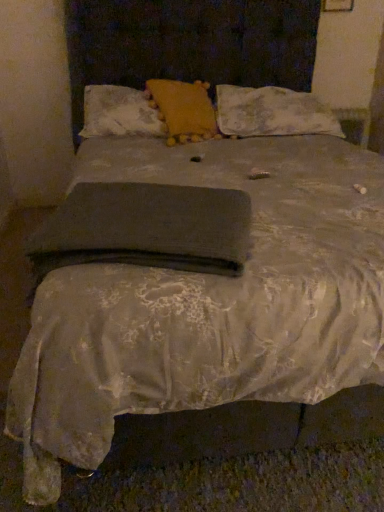
Question: Can you confirm if dark gray fabric at center is thinner than matte yellow pillow at upper center, which is counted as the 1th pillow, starting from the left?

Choices:
 (A) no
 (B) yes

Answer: (A)

Question: Considering the relative sizes of dark gray fabric at center and matte yellow pillow at upper center, which is counted as the 1th pillow, starting from the left, in the image provided, is dark gray fabric at center taller than matte yellow pillow at upper center, which is counted as the 1th pillow, starting from the left,?

Choices:
 (A) no
 (B) yes

Answer: (A)

Question: Is dark gray fabric at center looking in the opposite direction of matte yellow pillow at upper center, which is counted as the 1th pillow, starting from the left?

Choices:
 (A) yes
 (B) no

Answer: (A)

Question: Can you confirm if dark gray fabric at center is bigger than matte yellow pillow at upper center, placed as the 3th pillow when sorted from right to left?

Choices:
 (A) yes
 (B) no

Answer: (B)

Question: Is the depth of dark gray fabric at center less than that of matte yellow pillow at upper center, placed as the 3th pillow when sorted from right to left?

Choices:
 (A) yes
 (B) no

Answer: (A)

Question: From the image's perspective, is dark gray fabric at center below matte yellow pillow at upper center, which is counted as the 1th pillow, starting from the left?

Choices:
 (A) yes
 (B) no

Answer: (A)

Question: Does matte yellow pillow at upper center, placed as the 3th pillow when sorted from right to left, have a greater height compared to floral lace pillow at upper right, the 1th pillow when ordered from right to left?

Choices:
 (A) yes
 (B) no

Answer: (B)

Question: Is matte yellow pillow at upper center, which is counted as the 1th pillow, starting from the left, closer to the viewer compared to floral lace pillow at upper right, which appears as the 3th pillow when viewed from the left?

Choices:
 (A) no
 (B) yes

Answer: (B)

Question: Would you say matte yellow pillow at upper center, which is counted as the 1th pillow, starting from the left, is outside floral lace pillow at upper right, which appears as the 3th pillow when viewed from the left?

Choices:
 (A) no
 (B) yes

Answer: (B)

Question: Is matte yellow pillow at upper center, placed as the 3th pillow when sorted from right to left, beside floral lace pillow at upper right, which appears as the 3th pillow when viewed from the left?

Choices:
 (A) yes
 (B) no

Answer: (B)

Question: From a real-world perspective, does matte yellow pillow at upper center, which is counted as the 1th pillow, starting from the left, stand above floral lace pillow at upper right, the 1th pillow when ordered from right to left?

Choices:
 (A) no
 (B) yes

Answer: (B)

Question: From the image's perspective, is matte yellow pillow at upper center, which is counted as the 1th pillow, starting from the left, under floral lace pillow at upper right, which appears as the 3th pillow when viewed from the left?

Choices:
 (A) yes
 (B) no

Answer: (A)

Question: Is yellow fabric pillow at center, which ranks as the 2th pillow in right-to-left order, bigger than dark gray fabric at center?

Choices:
 (A) yes
 (B) no

Answer: (A)